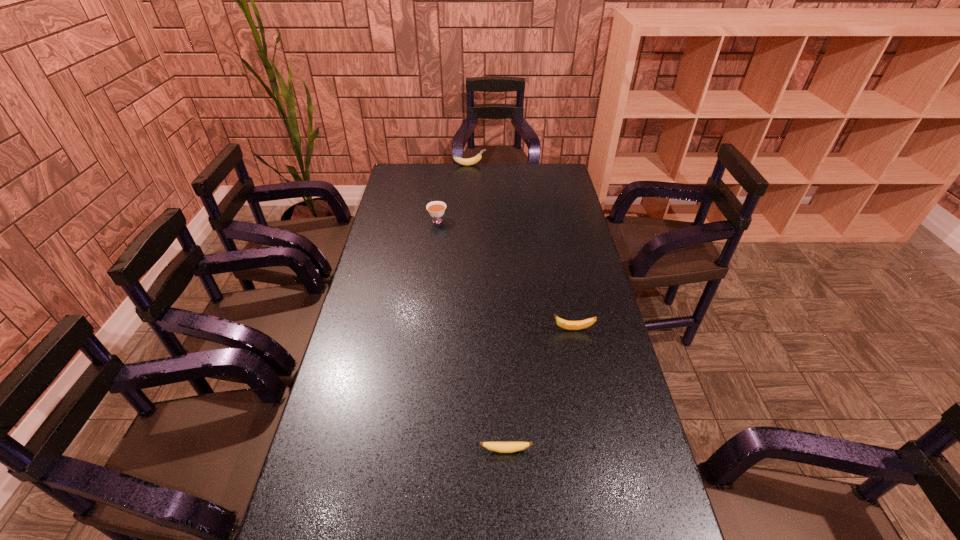
The width and height of the screenshot is (960, 540). I want to click on the tallest banana, so click(470, 161).

The image size is (960, 540). In order to click on the farthest object in this screenshot , I will do `click(470, 161)`.

Where is `the leftmost object`? the leftmost object is located at coordinates (436, 209).

This screenshot has height=540, width=960. Find the location of `the third nearest object`. the third nearest object is located at coordinates (436, 209).

The width and height of the screenshot is (960, 540). I want to click on the second shortest banana, so click(x=568, y=325).

In order to click on the second farthest banana in this screenshot , I will do coord(568,325).

Find the location of a particular element. the nearest banana is located at coordinates (501, 447).

The width and height of the screenshot is (960, 540). Identify the location of the nearest object. (501, 447).

I want to click on free region located at the stem of the farthest banana, so (548, 165).

The image size is (960, 540). Identify the location of vacant region located 0.320m on the side of the third nearest object with the handle. (430, 281).